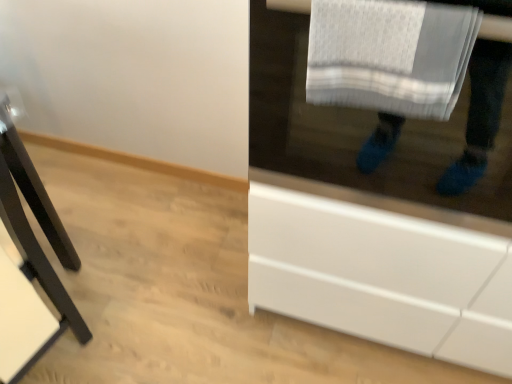
Question: From the image's perspective, is black matte table at left above or below white glossy cabinet at lower right?

Choices:
 (A) below
 (B) above

Answer: (A)

Question: In terms of height, does black matte table at left look taller or shorter compared to white glossy cabinet at lower right?

Choices:
 (A) tall
 (B) short

Answer: (A)

Question: Considering the real-world distances, which object is farthest from the black matte table at left?

Choices:
 (A) white glossy cabinet at lower right
 (B) white textured towel at upper right

Answer: (B)

Question: Considering the real-world distances, which object is farthest from the black matte table at left?

Choices:
 (A) white glossy cabinet at lower right
 (B) white textured towel at upper right

Answer: (B)